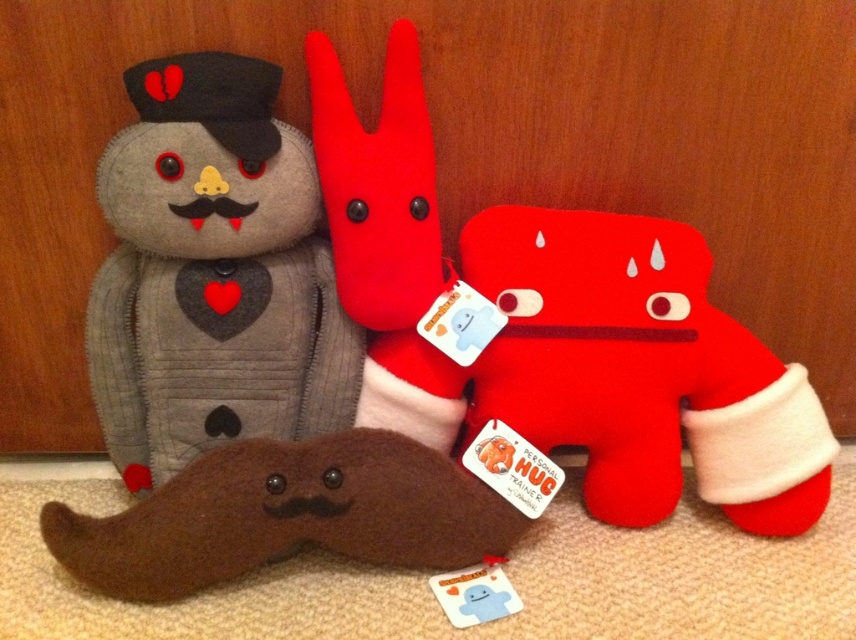
What is the 2D location of the matte red plush toy at center?

The matte red plush toy at center is located at point (639, 369).

You are a child who wants to pick up the matte red plush toy at center and the velvet plush rabbit at center from the wooden background. Which one do you need to pick up first?

The matte red plush toy at center is positioned under the velvet plush rabbit at center, so you need to pick up the velvet plush rabbit at center first to access the one underneath.

You are a child trying to find the brown fuzzy mustache at lower left and the velvet plush rabbit at center in the image. Which object is positioned lower in the image?

The brown fuzzy mustache at lower left is located below the velvet plush rabbit at center, so it is positioned lower in the image.